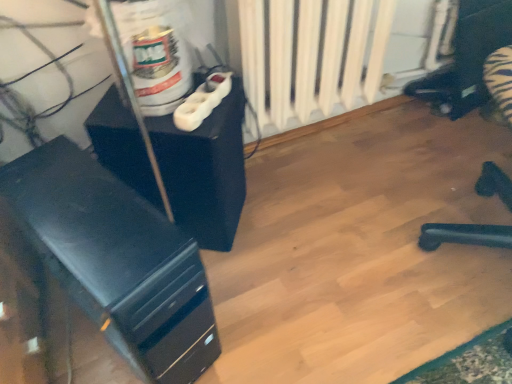
Question: Is white plastic plug at upper center thinner than black matte computer tower at left, which ranks as the 1th furniture in bottom-to-top order?

Choices:
 (A) no
 (B) yes

Answer: (B)

Question: Is white plastic plug at upper center not within black matte computer tower at left, which ranks as the 1th furniture in bottom-to-top order?

Choices:
 (A) yes
 (B) no

Answer: (A)

Question: Can you confirm if white plastic plug at upper center is smaller than black matte computer tower at left, which ranks as the 1th furniture in bottom-to-top order?

Choices:
 (A) no
 (B) yes

Answer: (B)

Question: Does white plastic plug at upper center have a greater height compared to black matte computer tower at left, which ranks as the 1th furniture in bottom-to-top order?

Choices:
 (A) no
 (B) yes

Answer: (A)

Question: Would you say white plastic plug at upper center contains black matte computer tower at left, which is counted as the 2th furniture, starting from the top?

Choices:
 (A) yes
 (B) no

Answer: (B)

Question: Is white plastic plug at upper center closer to the viewer compared to black matte computer tower at left, which is counted as the 2th furniture, starting from the top?

Choices:
 (A) no
 (B) yes

Answer: (A)

Question: Does matte black cabinet at center-left, placed as the first furniture when sorted from top to bottom, have a lesser width compared to black matte computer tower at left, which ranks as the 1th furniture in bottom-to-top order?

Choices:
 (A) yes
 (B) no

Answer: (A)

Question: Does matte black cabinet at center-left, which appears as the second furniture when ordered from the bottom, contain black matte computer tower at left, which ranks as the 1th furniture in bottom-to-top order?

Choices:
 (A) yes
 (B) no

Answer: (B)

Question: Is matte black cabinet at center-left, placed as the first furniture when sorted from top to bottom, taller than black matte computer tower at left, which is counted as the 2th furniture, starting from the top?

Choices:
 (A) no
 (B) yes

Answer: (A)

Question: Can you confirm if matte black cabinet at center-left, placed as the first furniture when sorted from top to bottom, is positioned to the left of black matte computer tower at left, which is counted as the 2th furniture, starting from the top?

Choices:
 (A) yes
 (B) no

Answer: (B)

Question: Does matte black cabinet at center-left, which appears as the second furniture when ordered from the bottom, touch black matte computer tower at left, which is counted as the 2th furniture, starting from the top?

Choices:
 (A) yes
 (B) no

Answer: (B)

Question: Is matte black cabinet at center-left, placed as the first furniture when sorted from top to bottom, closer to camera compared to black matte computer tower at left, which ranks as the 1th furniture in bottom-to-top order?

Choices:
 (A) yes
 (B) no

Answer: (B)

Question: Is matte black cabinet at center-left, which appears as the second furniture when ordered from the bottom, surrounded by white plastic plug at upper center?

Choices:
 (A) yes
 (B) no

Answer: (B)